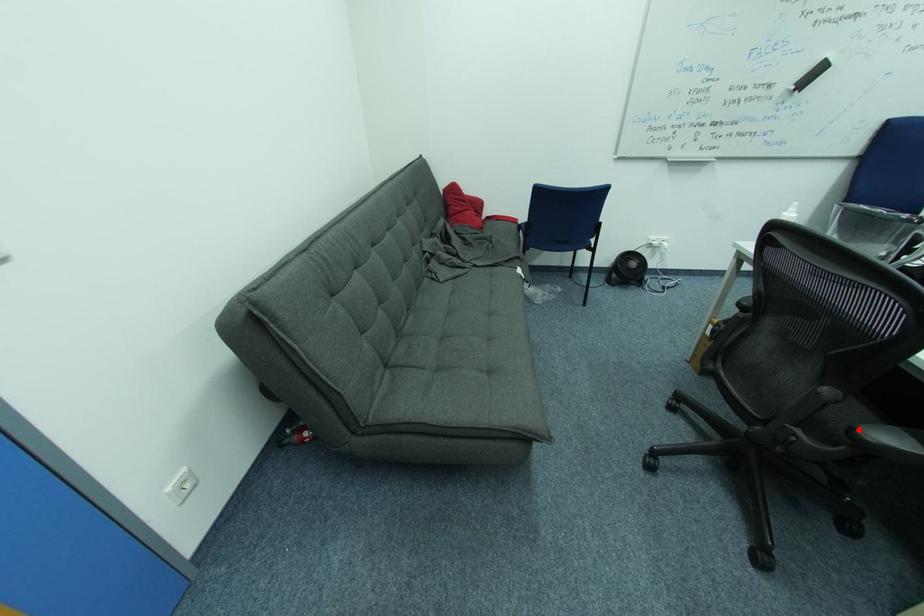
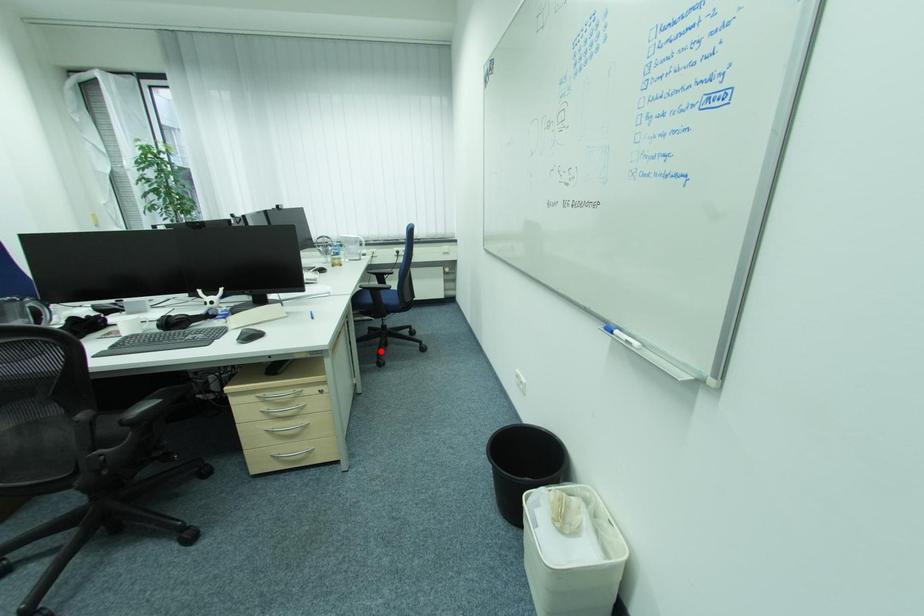
I am providing you with two images of the same scene from different viewpoints. A red point is marked on the first image and another point is marked on the second image. Do the highlighted points in image1 and image2 indicate the same real-world spot?

No